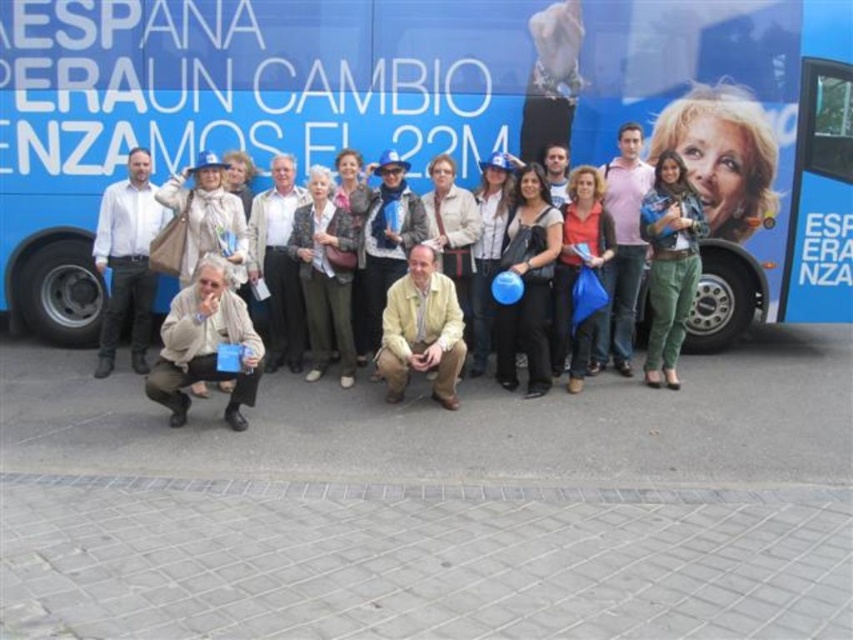
Is white shirt at left wider than black matte dress at center?

Indeed, white shirt at left has a greater width compared to black matte dress at center.

Does white shirt at left lie behind black matte dress at center?

That is True.

Is point (119, 243) less distant than point (529, 307)?

No, (119, 243) is further to viewer.

Find the location of `white shirt at left`. white shirt at left is located at coordinates (126, 259).

Can you confirm if blue matte bus at center is wider than white shirt at left?

Yes, blue matte bus at center is wider than white shirt at left.

Who is shorter, blue matte bus at center or white shirt at left?

Standing shorter between the two is white shirt at left.

The height and width of the screenshot is (640, 853). What do you see at coordinates (410, 116) in the screenshot?
I see `blue matte bus at center` at bounding box center [410, 116].

Locate an element on the screen. The width and height of the screenshot is (853, 640). blue matte bus at center is located at coordinates (410, 116).

Is green textured pants at center smaller than pink cotton shirt at center?

Incorrect, green textured pants at center is not smaller in size than pink cotton shirt at center.

Between green textured pants at center and pink cotton shirt at center, which one has less height?

green textured pants at center

Where is `green textured pants at center`? green textured pants at center is located at coordinates (323, 276).

Locate an element on the screen. This screenshot has height=640, width=853. green textured pants at center is located at coordinates (323, 276).